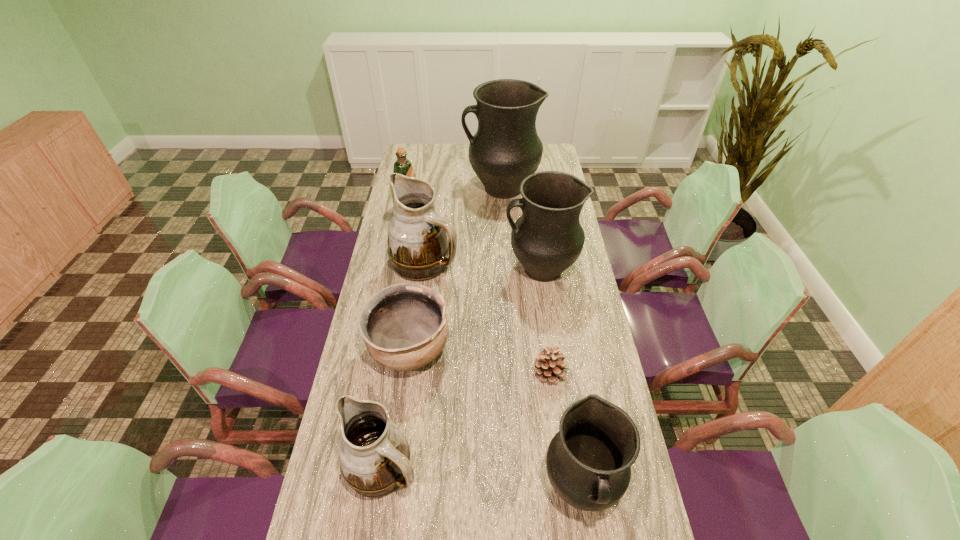
This screenshot has width=960, height=540. I want to click on the tallest object, so click(x=506, y=148).

What are the coordinates of `the farthest black pitcher` in the screenshot? It's located at (506, 148).

Where is `the bigger brown pitcher`? The image size is (960, 540). the bigger brown pitcher is located at coordinates (418, 247).

Identify the location of the second smallest black pitcher. (547, 239).

Identify the location of olive oil. (403, 166).

Locate an element on the screen. the nearest black pitcher is located at coordinates click(x=588, y=462).

The height and width of the screenshot is (540, 960). Find the location of `the smaller brown pitcher`. the smaller brown pitcher is located at coordinates (374, 455).

Where is `the seventh tallest object`? This screenshot has height=540, width=960. the seventh tallest object is located at coordinates point(404,326).

At what (x,y) coordinates should I click in order to perform the action: click on pinecone. Please return your answer as a coordinate pair (x, y). The height and width of the screenshot is (540, 960). Looking at the image, I should click on (550, 366).

Locate an element on the screen. the shortest object is located at coordinates (550, 366).